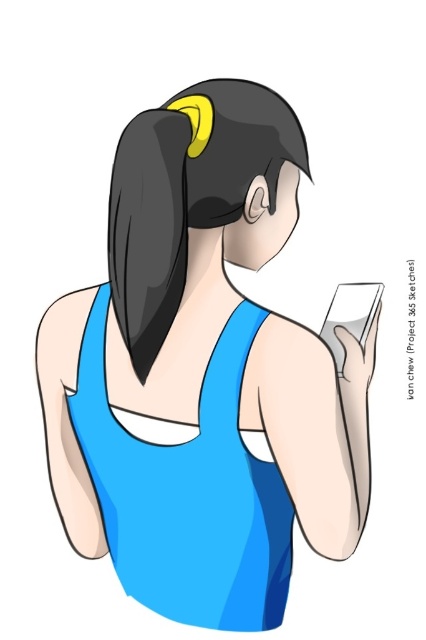
Measure the distance between blue matte dress at center and camera.

blue matte dress at center and camera are 35.65 inches apart from each other.

Identify the location of blue matte dress at center. (189, 493).

Between point (126, 566) and point (152, 182), which one is positioned behind?

Positioned behind is point (126, 566).

Locate an element on the screen. blue matte dress at center is located at coordinates (189, 493).

Can you confirm if blue matte dress at center is bigger than black matte hair at upper center?

Yes, blue matte dress at center is bigger than black matte hair at upper center.

The width and height of the screenshot is (426, 640). Find the location of `blue matte dress at center`. blue matte dress at center is located at coordinates (189, 493).

Is blue matte dress at center thinner than matte white phone at upper right?

In fact, blue matte dress at center might be wider than matte white phone at upper right.

Who is taller, blue matte dress at center or matte white phone at upper right?

blue matte dress at center

The width and height of the screenshot is (426, 640). Describe the element at coordinates (189, 493) in the screenshot. I see `blue matte dress at center` at that location.

Identify the location of blue matte dress at center. (189, 493).